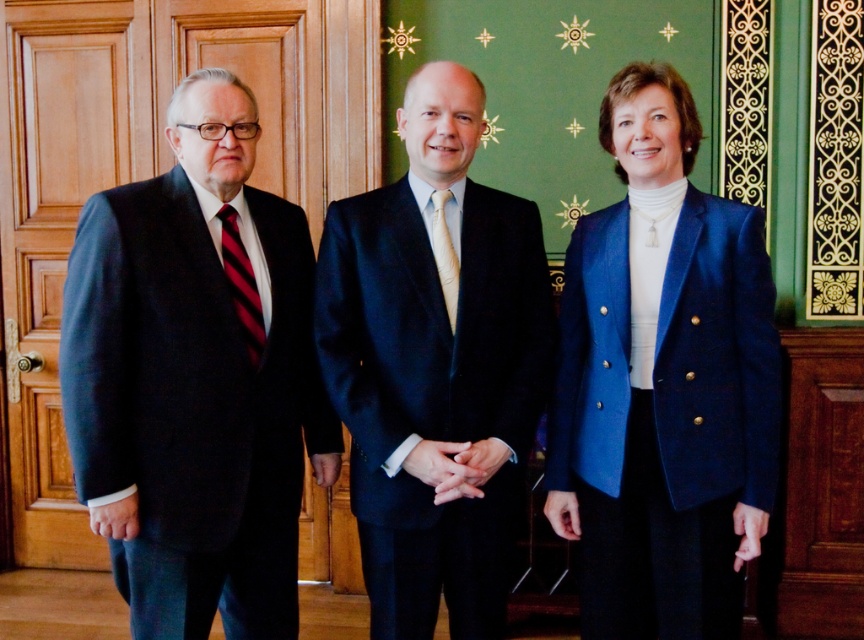
Is black satin suit at center below striped silk tie at left?

Yes.

The height and width of the screenshot is (640, 864). What do you see at coordinates (435, 369) in the screenshot? I see `black satin suit at center` at bounding box center [435, 369].

Does point (467, 474) come closer to viewer compared to point (232, 216)?

Yes.

Where is `black satin suit at center`? black satin suit at center is located at coordinates (435, 369).

Does black satin suit at center have a smaller size compared to light beige silk tie at center?

No.

Is point (321, 336) positioned in front of point (446, 250)?

No, it is behind (446, 250).

Which is in front, point (359, 211) or point (455, 259)?

Positioned in front is point (455, 259).

Locate an element on the screen. The image size is (864, 640). black satin suit at center is located at coordinates (435, 369).

Is blue woolen blazer at right thinner than black satin suit at center?

Indeed, blue woolen blazer at right has a lesser width compared to black satin suit at center.

This screenshot has height=640, width=864. Identify the location of blue woolen blazer at right. (664, 381).